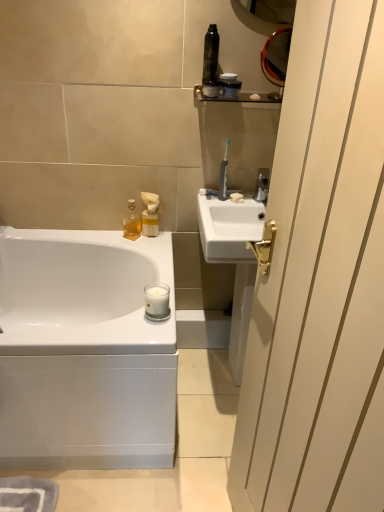
Where is `vacant space in front of translucent glass bottle at upper left, which appears as the 1th toiletry when ordered from the bottom`? The image size is (384, 512). vacant space in front of translucent glass bottle at upper left, which appears as the 1th toiletry when ordered from the bottom is located at coordinates (134, 248).